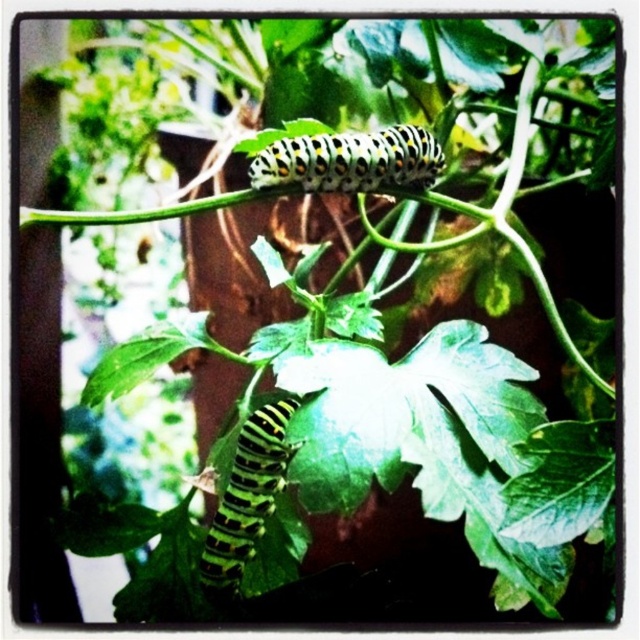
Question: Does green and black spotted caterpillar at upper center appear under black striped caterpillar at lower left?

Choices:
 (A) yes
 (B) no

Answer: (B)

Question: Which object is closer to the camera taking this photo?

Choices:
 (A) black striped caterpillar at lower left
 (B) green and black spotted caterpillar at upper center

Answer: (A)

Question: Which point is closer to the camera taking this photo?

Choices:
 (A) (332, 156)
 (B) (243, 548)

Answer: (B)

Question: Is green and black spotted caterpillar at upper center thinner than black striped caterpillar at lower left?

Choices:
 (A) yes
 (B) no

Answer: (B)

Question: Among these points, which one is nearest to the camera?

Choices:
 (A) (333, 154)
 (B) (234, 588)

Answer: (B)

Question: Can you confirm if green and black spotted caterpillar at upper center is smaller than black striped caterpillar at lower left?

Choices:
 (A) no
 (B) yes

Answer: (B)